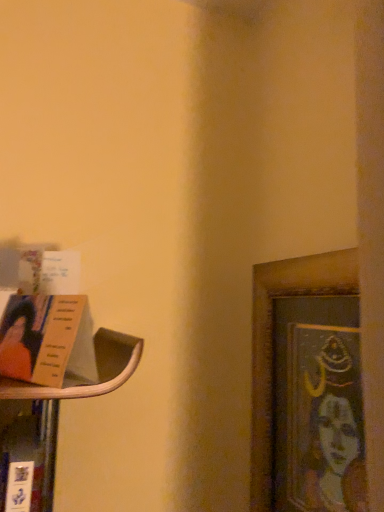
Question: Is matte paper book at left smaller than wooden framed portrait at right?

Choices:
 (A) yes
 (B) no

Answer: (A)

Question: From a real-world perspective, is matte paper book at left over wooden framed portrait at right?

Choices:
 (A) no
 (B) yes

Answer: (B)

Question: Can you confirm if matte paper book at left is bigger than wooden framed portrait at right?

Choices:
 (A) yes
 (B) no

Answer: (B)

Question: Considering the relative sizes of matte paper book at left and wooden framed portrait at right in the image provided, is matte paper book at left thinner than wooden framed portrait at right?

Choices:
 (A) no
 (B) yes

Answer: (B)

Question: Is matte paper book at left at the right side of wooden framed portrait at right?

Choices:
 (A) no
 (B) yes

Answer: (A)

Question: Is matte paper book at left positioned beyond the bounds of wooden framed portrait at right?

Choices:
 (A) no
 (B) yes

Answer: (B)

Question: Is wooden framed portrait at right positioned behind matte paper book at left?

Choices:
 (A) yes
 (B) no

Answer: (A)

Question: Does wooden framed portrait at right lie in front of matte paper book at left?

Choices:
 (A) no
 (B) yes

Answer: (A)

Question: Does wooden framed portrait at right contain matte paper book at left?

Choices:
 (A) yes
 (B) no

Answer: (B)

Question: Does wooden framed portrait at right have a greater height compared to matte paper book at left?

Choices:
 (A) yes
 (B) no

Answer: (A)

Question: From the image's perspective, does wooden framed portrait at right appear higher than matte paper book at left?

Choices:
 (A) yes
 (B) no

Answer: (B)

Question: Is wooden framed portrait at right bigger than matte paper book at left?

Choices:
 (A) no
 (B) yes

Answer: (B)

Question: Is wooden framed portrait at right taller or shorter than matte paper book at left?

Choices:
 (A) tall
 (B) short

Answer: (A)